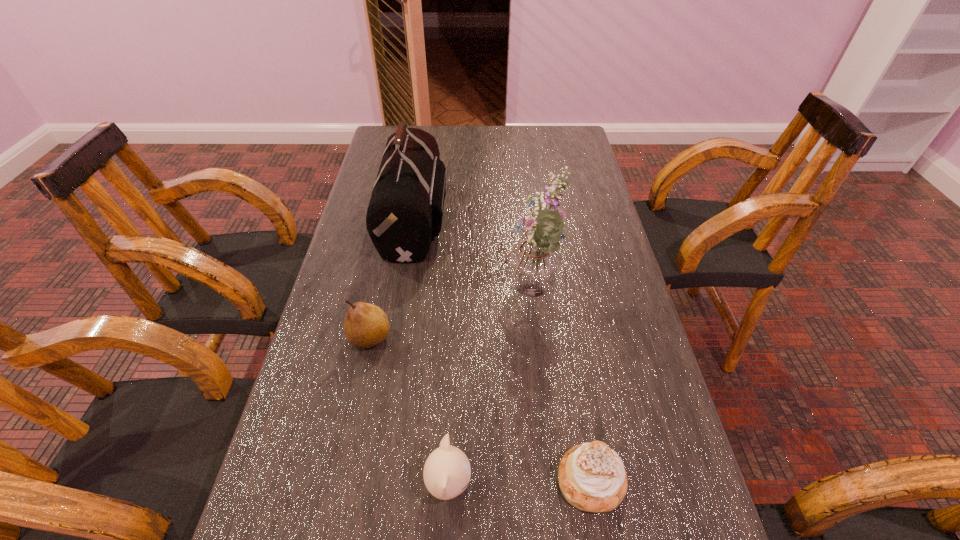
Locate an element on the screen. This screenshot has width=960, height=540. free space that is in between the pear and the bouquet is located at coordinates (451, 318).

Where is `empty space that is in between the pastry and the kitten`? This screenshot has height=540, width=960. empty space that is in between the pastry and the kitten is located at coordinates (519, 482).

You are a GUI agent. You are given a task and a screenshot of the screen. Output one action in this format:
    pyautogui.click(x=<x>, y=<y>)
    Task: Click on the vacant space that's between the pastry and the bouquet
    Image resolution: width=960 pixels, height=540 pixels.
    Given the screenshot: What is the action you would take?
    pyautogui.click(x=562, y=389)

I want to click on vacant space that's between the pastry and the duffel bag, so click(x=503, y=349).

This screenshot has width=960, height=540. Find the location of `free space between the second tallest object and the tallest object`. free space between the second tallest object and the tallest object is located at coordinates (473, 258).

Identify the location of free area in between the pastry and the tallest object. This screenshot has height=540, width=960. (562, 389).

In order to click on free point between the tallest object and the third object from right to left in this screenshot , I will do `click(491, 390)`.

This screenshot has width=960, height=540. I want to click on vacant region between the tallest object and the third shortest object, so click(x=451, y=318).

In order to click on free space that is in between the tallest object and the pastry in this screenshot , I will do `click(562, 389)`.

This screenshot has height=540, width=960. Identify the location of the closest object relative to the bouquet. (406, 207).